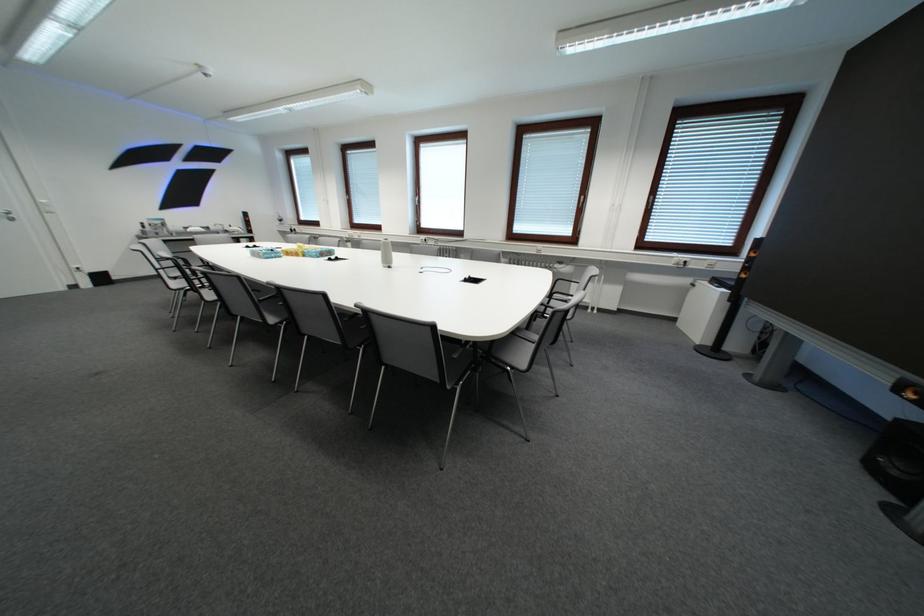
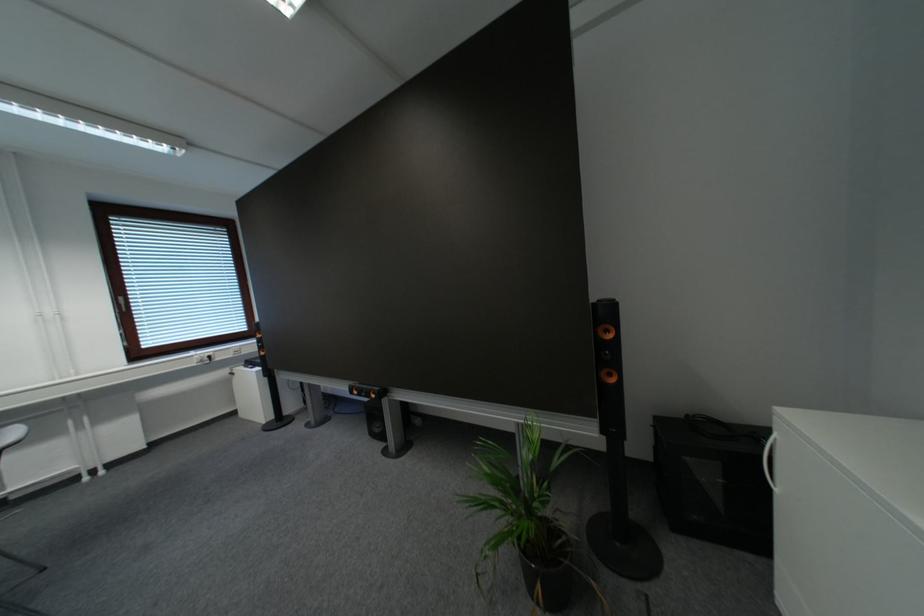
Find the pixel in the second image that matches the point at 685,257 in the first image.

(201, 355)